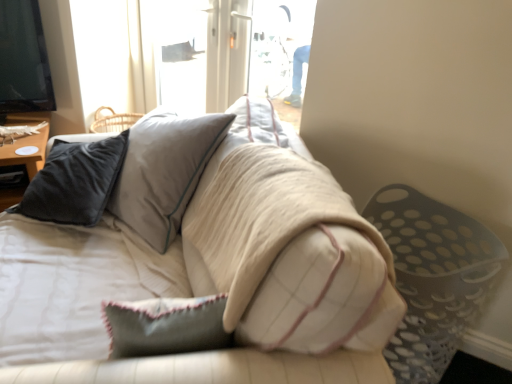
Locate an element on the screen. The height and width of the screenshot is (384, 512). free space above matte black pillow at left (from a real-world perspective) is located at coordinates (18, 128).